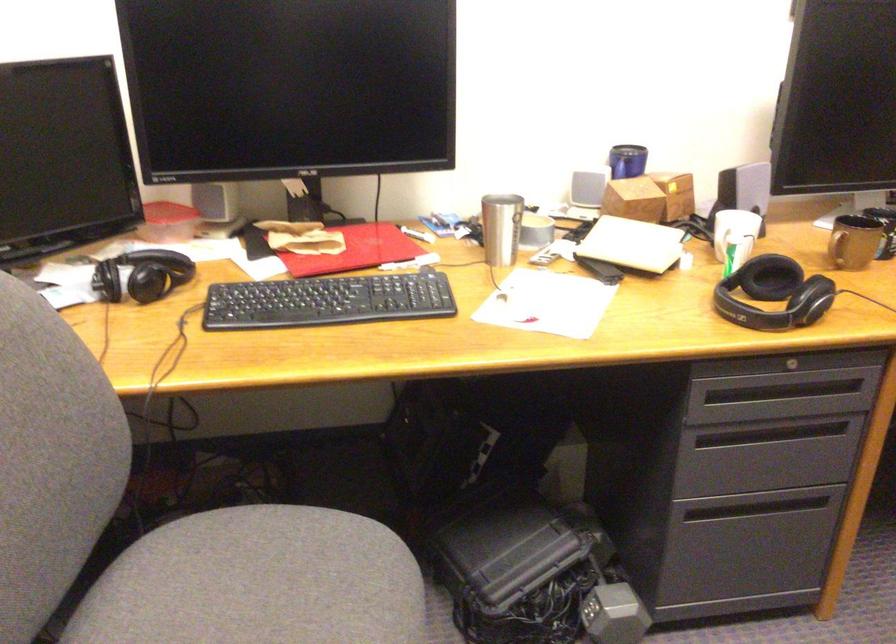
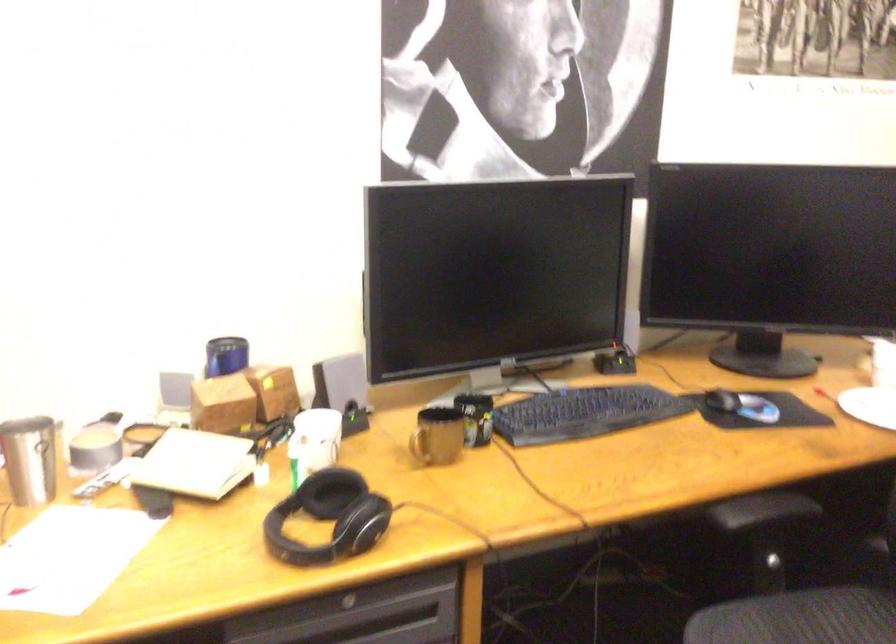
The point at [754,212] is marked in the first image. Where is the corresponding point in the second image?

(352, 413)